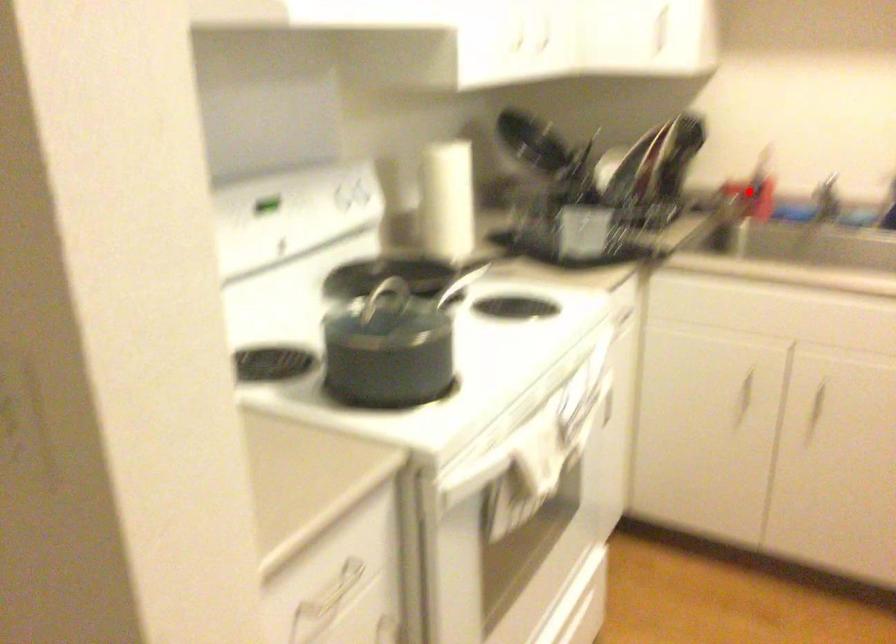
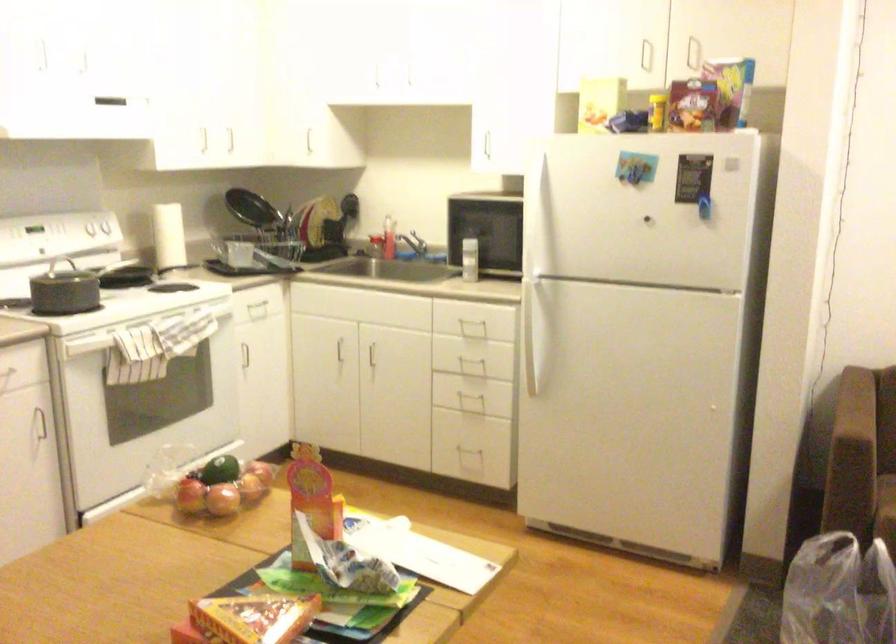
Question: I am providing you with two images of the same scene from different viewpoints. A red point is shown in image1. For the corresponding object point in image2, is it positioned nearer or farther from the camera?

Choices:
 (A) Nearer
 (B) Farther

Answer: (B)